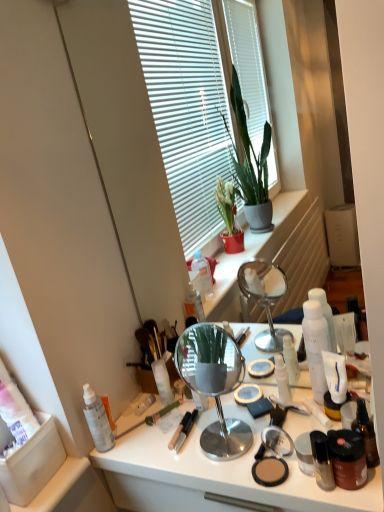
Locate an element on the screen. vacant area to the right of green plastic paint brush at lower left is located at coordinates (205, 418).